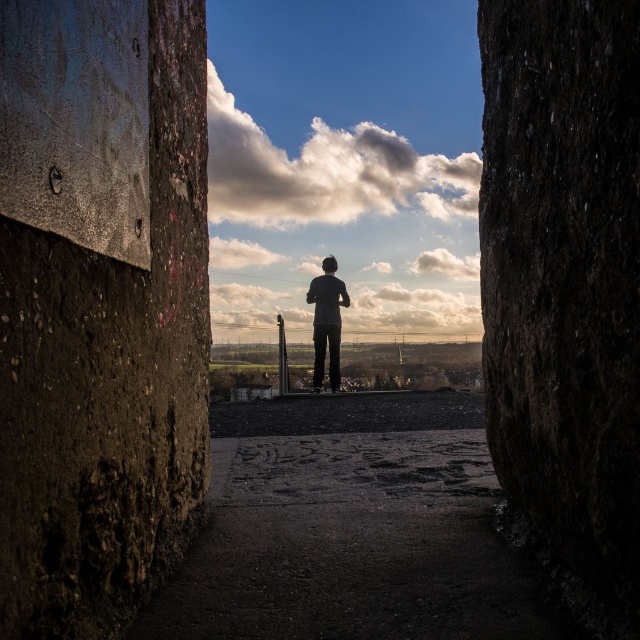
Question: Can you confirm if dark concrete alley at center is smaller than dark gray fabric at center?

Choices:
 (A) no
 (B) yes

Answer: (B)

Question: Considering the relative positions of dark concrete alley at center and smooth concrete pole at center in the image provided, where is dark concrete alley at center located with respect to smooth concrete pole at center?

Choices:
 (A) left
 (B) right

Answer: (B)

Question: Does rusty concrete wall at center appear on the left side of smooth concrete pole at center?

Choices:
 (A) yes
 (B) no

Answer: (B)

Question: Which point is closer to the camera?

Choices:
 (A) dark gray fabric at center
 (B) dark concrete alley at center
 (C) smooth concrete pole at center

Answer: (B)

Question: Which object is farther from the camera taking this photo?

Choices:
 (A) smooth concrete pole at center
 (B) dark concrete alley at center
 (C) rusty concrete wall at center
 (D) dark gray fabric at center

Answer: (D)

Question: Which object is positioned closest to the dark concrete alley at center?

Choices:
 (A) rusty concrete wall at center
 (B) smooth concrete pole at center

Answer: (A)